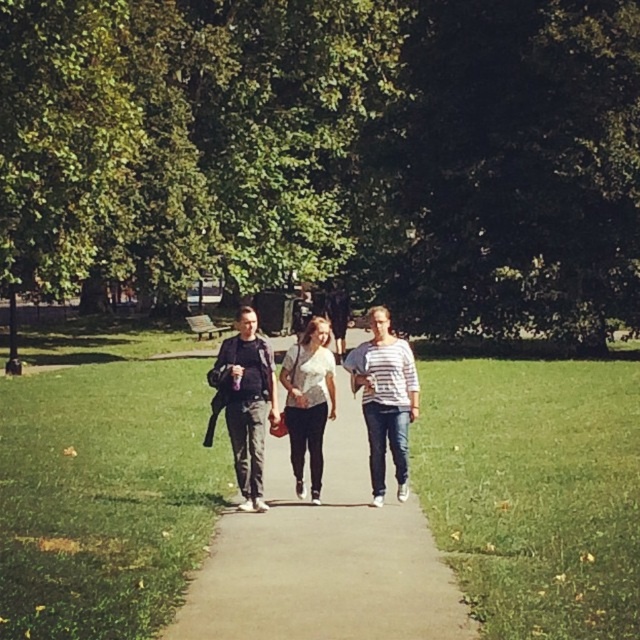
Between smooth concrete path at center and white matte shirt at center, which one appears on the right side from the viewer's perspective?

smooth concrete path at center

Where is `smooth concrete path at center`? smooth concrete path at center is located at coordinates (324, 557).

Between point (394, 572) and point (307, 435), which one is positioned behind?

Positioned behind is point (307, 435).

Locate an element on the screen. This screenshot has height=640, width=640. smooth concrete path at center is located at coordinates (324, 557).

Based on the photo, can you confirm if smooth concrete path at center is shorter than white striped shirt at center?

Incorrect, smooth concrete path at center's height does not fall short of white striped shirt at center's.

Between smooth concrete path at center and white striped shirt at center, which one appears on the left side from the viewer's perspective?

Positioned to the left is smooth concrete path at center.

Which is in front, point (420, 570) or point (384, 428)?

Point (420, 570) is in front.

Identify the location of smooth concrete path at center. This screenshot has width=640, height=640. pos(324,557).

Who is more forward, (385, 353) or (284, 388)?

Positioned in front is point (385, 353).

Can you confirm if white striped shirt at center is positioned to the left of white matte shirt at center?

In fact, white striped shirt at center is to the right of white matte shirt at center.

Between point (376, 461) and point (317, 456), which one is positioned behind?

The point (317, 456) is behind.

I want to click on white striped shirt at center, so click(385, 400).